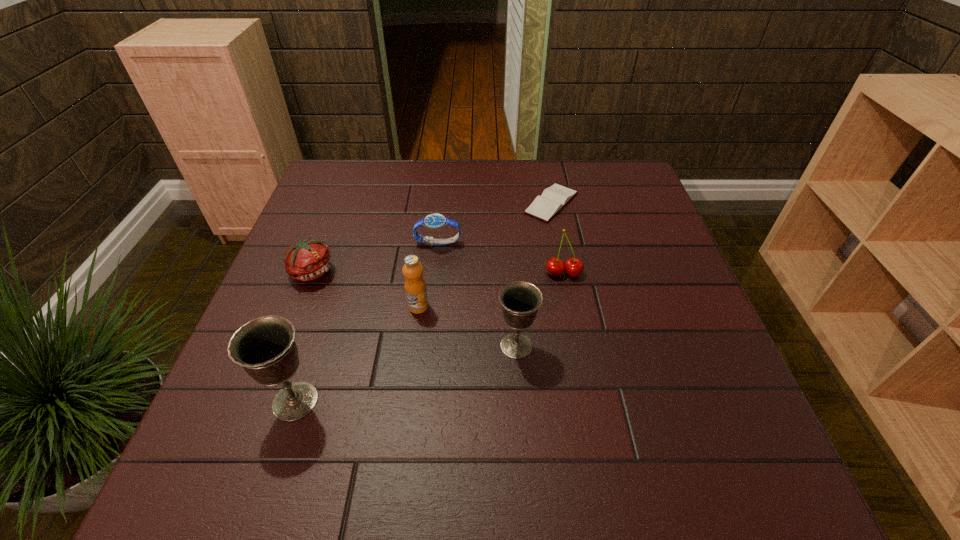
This screenshot has width=960, height=540. I want to click on chalice at the left edge, so click(265, 347).

Identify the location of tomato that is positioned at the left edge. (309, 259).

Locate an element on the screen. object located in the near left corner section of the desktop is located at coordinates (265, 347).

Find the location of a particular element. This screenshot has width=960, height=540. vacant region at the far edge of the desktop is located at coordinates (373, 200).

The height and width of the screenshot is (540, 960). In order to click on vacant position at the left edge of the desktop in this screenshot , I will do `click(326, 245)`.

Where is `vacant area at the right edge of the desktop`? This screenshot has height=540, width=960. vacant area at the right edge of the desktop is located at coordinates (670, 320).

You are a GUI agent. You are given a task and a screenshot of the screen. Output one action in this format:
    pyautogui.click(x=<x>, y=<y>)
    Task: Click on the vacant region at the far left corner of the desktop
    The height and width of the screenshot is (540, 960).
    Given the screenshot: What is the action you would take?
    pyautogui.click(x=332, y=160)

Locate an element on the screen. free space at the far right corner is located at coordinates (605, 174).

This screenshot has width=960, height=540. Identify the location of vacant space at the near right corner of the desktop. (682, 395).

Image resolution: width=960 pixels, height=540 pixels. Find the location of `free space between the shortest object and the third shortest object`. free space between the shortest object and the third shortest object is located at coordinates 432,237.